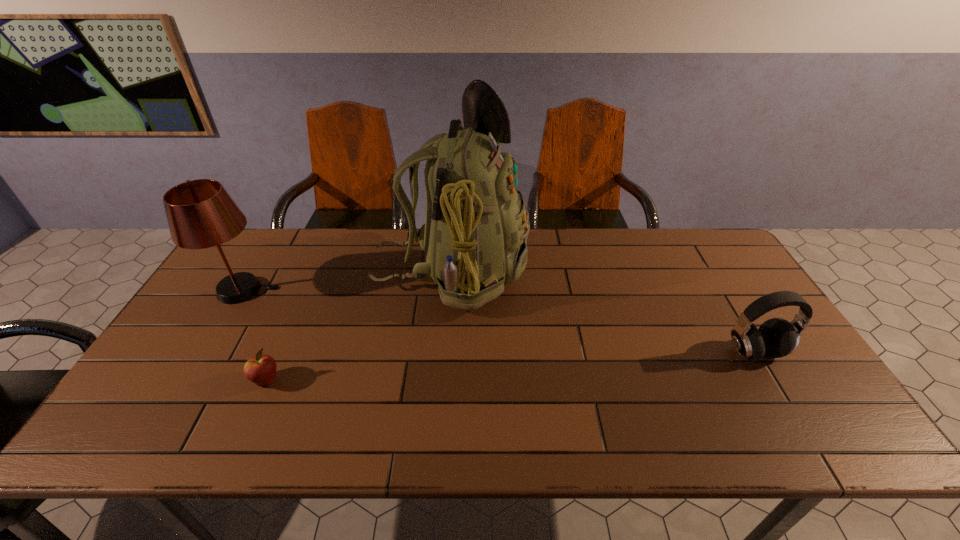
The image size is (960, 540). I want to click on free space at the far left corner of the desktop, so click(262, 239).

Locate an element on the screen. The height and width of the screenshot is (540, 960). vacant space at the near left corner of the desktop is located at coordinates (151, 441).

Identify the location of vacant space that's between the tallest object and the rightmost object. click(603, 312).

Identify the location of unoccupied area between the apple and the rightmost object. This screenshot has height=540, width=960. (511, 366).

This screenshot has height=540, width=960. In order to click on unoccupied area between the nearest object and the leftmost object in this screenshot , I will do `click(254, 335)`.

This screenshot has height=540, width=960. I want to click on free spot between the rightmost object and the third object from left to right, so click(x=603, y=312).

At what (x,y) coordinates should I click in order to perform the action: click on vacant area between the apple and the second object from right to left. Please return your answer as a coordinate pair (x, y). Image resolution: width=960 pixels, height=540 pixels. Looking at the image, I should click on (358, 327).

The height and width of the screenshot is (540, 960). In order to click on empty location between the lampshade and the backpack in this screenshot , I will do `click(347, 281)`.

This screenshot has width=960, height=540. In order to click on free space between the second tallest object and the backpack in this screenshot , I will do `click(347, 281)`.

Locate an element on the screen. The image size is (960, 540). vacant space in between the lampshade and the backpack is located at coordinates (347, 281).